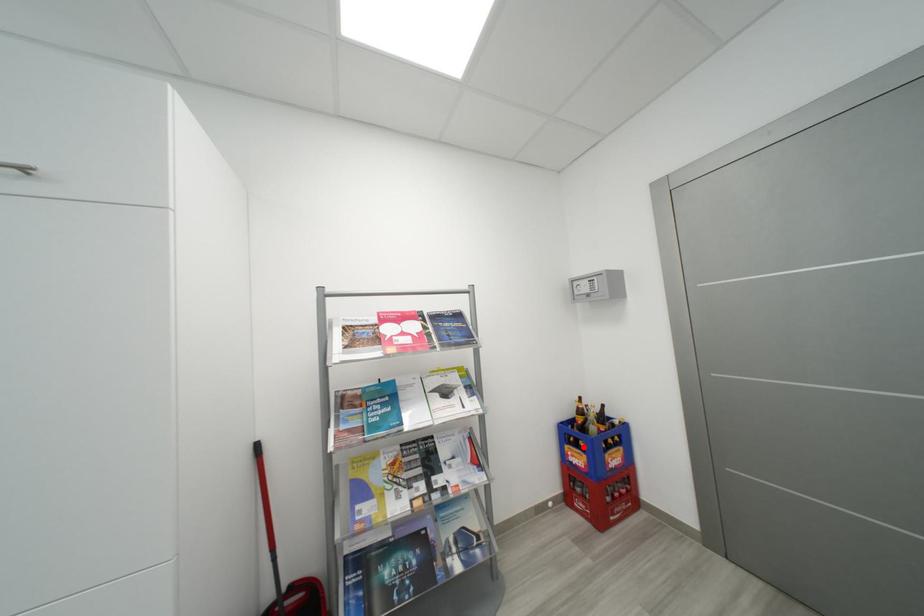
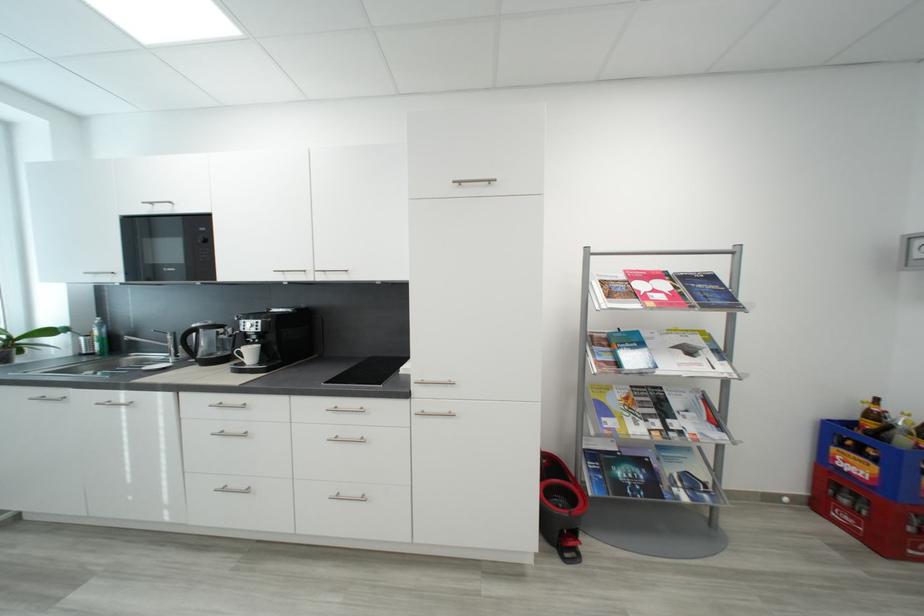
Question: I am providing you with two images of the same scene from different viewpoints. In image1, a red point is highlighted. Considering the same 3D point in image2, which of the following is correct?

Choices:
 (A) It is closer
 (B) It is farther

Answer: (A)